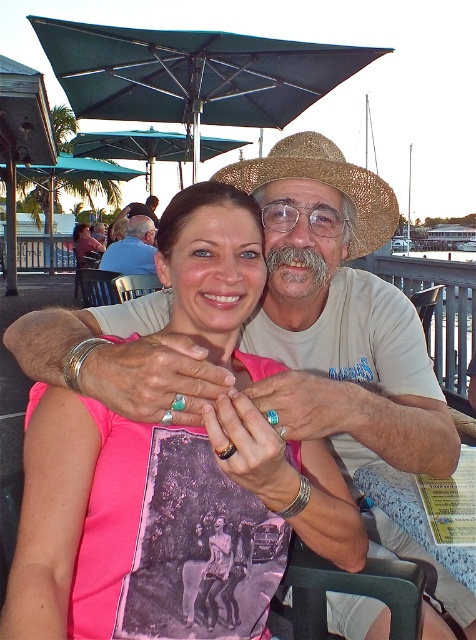
Does point (89, 577) come farther from viewer compared to point (42, 177)?

No, (89, 577) is in front of (42, 177).

Between pink fabric shirt at center and green fabric umbrella at upper left, which one appears on the right side from the viewer's perspective?

Positioned to the right is pink fabric shirt at center.

Is point (327, 554) closer to viewer compared to point (0, 173)?

That is True.

Locate an element on the screen. pink fabric shirt at center is located at coordinates (61, 500).

Describe the element at coordinates (192, 74) in the screenshot. I see `green fabric umbrella at upper center` at that location.

Does green fabric umbrella at upper center come in front of matte white shirt at center?

Yes, green fabric umbrella at upper center is in front of matte white shirt at center.

Does point (119, 96) come closer to viewer compared to point (134, 236)?

Yes, point (119, 96) is closer to viewer.

This screenshot has width=476, height=640. I want to click on green fabric umbrella at upper center, so click(192, 74).

Who is lower down, pink fabric shirt at center or matte white shirt at center?

pink fabric shirt at center

Is the position of pink fabric shirt at center more distant than that of matte white shirt at center?

No, pink fabric shirt at center is in front of matte white shirt at center.

Does point (208, 216) lie behind point (117, 262)?

No, it is not.

This screenshot has width=476, height=640. I want to click on pink fabric shirt at center, so click(61, 500).